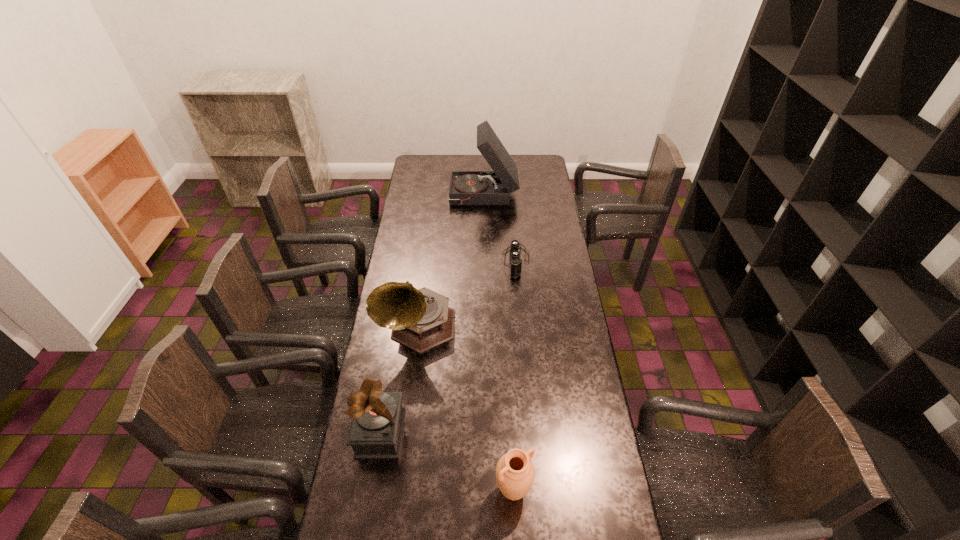
The width and height of the screenshot is (960, 540). I want to click on vacant position in the image that satisfies the following two spatial constraints: 1. on the front side of the binoculars; 2. at the horn opening of the fourth farthest object, so click(x=530, y=433).

The height and width of the screenshot is (540, 960). What are the coordinates of `free spot that satisfies the following two spatial constraints: 1. on the back side of the fourth tallest object; 2. at the horn opening of the nearest phonograph_record` in the screenshot? It's located at (510, 433).